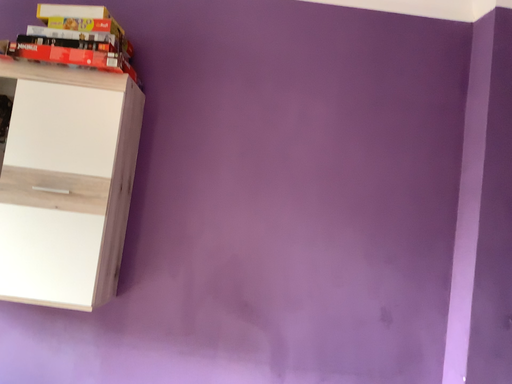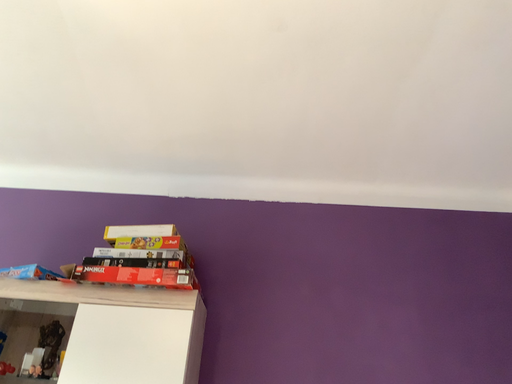
Question: Which way did the camera rotate in the video?

Choices:
 (A) rotated downward
 (B) rotated upward

Answer: (B)